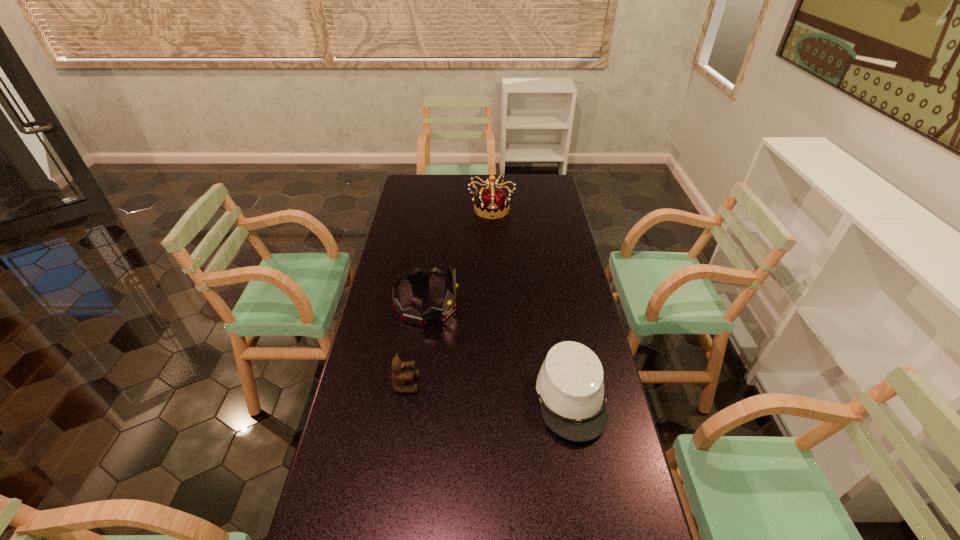
Find the location of a particular element. The image size is (960, 540). object that is positioned at the far edge is located at coordinates (492, 202).

At what (x,y) coordinates should I click in order to perform the action: click on tiara that is positioned at the left edge. Please return your answer as a coordinate pair (x, y). Image resolution: width=960 pixels, height=540 pixels. Looking at the image, I should click on (419, 277).

Identify the location of teddy bear that is at the left edge. (399, 377).

Where is `object positioned at the right edge`? The image size is (960, 540). object positioned at the right edge is located at coordinates (570, 386).

You are a GUI agent. You are given a task and a screenshot of the screen. Output one action in this format:
    pyautogui.click(x=<x>, y=<y>)
    Task: Click on the free space at the left edge of the desktop
    
    Given the screenshot: What is the action you would take?
    pyautogui.click(x=412, y=264)

Identify the location of vacant space at the right edge of the desktop. The height and width of the screenshot is (540, 960). (626, 453).

The width and height of the screenshot is (960, 540). In the image, there is a desktop. In order to click on blank space at the far left corner in this screenshot , I will do `click(417, 192)`.

The image size is (960, 540). What are the coordinates of `vacant space at the far right corner of the desktop` in the screenshot? It's located at (524, 177).

Where is `free space between the rightmost object and the shorter tiara`? The height and width of the screenshot is (540, 960). free space between the rightmost object and the shorter tiara is located at coordinates (499, 351).

The image size is (960, 540). In order to click on free space between the nearer tiara and the teddy bear in this screenshot , I will do `click(417, 344)`.